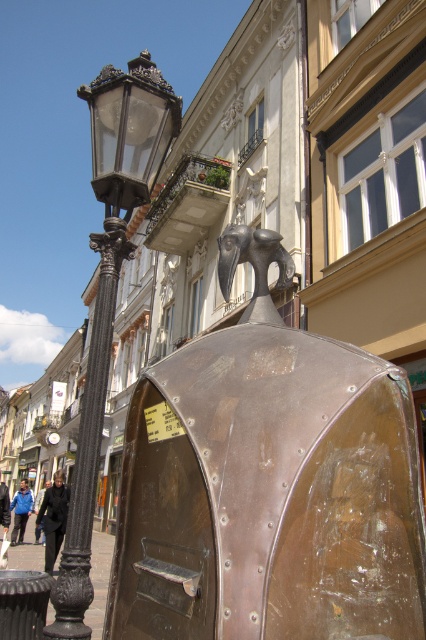
Is black glass lamp post at left positioned behind black wrought iron pole at left?

That is True.

Is black glass lamp post at left above black wrought iron pole at left?

Yes, black glass lamp post at left is above black wrought iron pole at left.

Which is in front, point (135, 60) or point (54, 636)?

Point (54, 636)

Locate an element on the screen. This screenshot has width=426, height=640. black glass lamp post at left is located at coordinates (109, 289).

Does black glass lamp post at left have a greater width compared to polished bronze bird at center?

Yes, black glass lamp post at left is wider than polished bronze bird at center.

From the picture: Is black glass lamp post at left to the right of polished bronze bird at center from the viewer's perspective?

In fact, black glass lamp post at left is to the left of polished bronze bird at center.

Is point (157, 104) less distant than point (241, 250)?

No, (157, 104) is further to viewer.

Find the location of `black glass lamp post at left`. black glass lamp post at left is located at coordinates 109,289.

Which is above, bronze/copper textured mailbox at center or black wrought iron pole at left?

Positioned higher is bronze/copper textured mailbox at center.

Where is `bronze/copper textured mailbox at center`? bronze/copper textured mailbox at center is located at coordinates (267, 484).

Which is behind, point (362, 412) or point (112, 244)?

The point (112, 244) is behind.

I want to click on bronze/copper textured mailbox at center, so click(x=267, y=484).